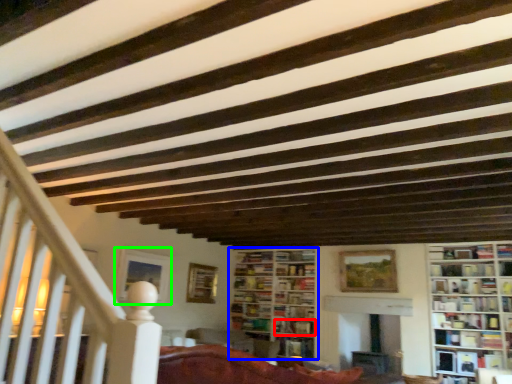
Question: Which object is the closest to the book (highlighted by a red box)? Choose among these: bookcase (highlighted by a blue box) or picture frame (highlighted by a green box).

Choices:
 (A) bookcase
 (B) picture frame

Answer: (A)